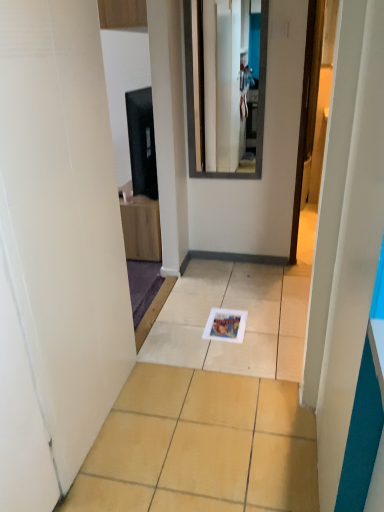
Question: From the image's perspective, is white glossy tile at center above or below smooth glass mirror at upper center?

Choices:
 (A) above
 (B) below

Answer: (B)

Question: Is white glossy tile at center wider or thinner than smooth glass mirror at upper center?

Choices:
 (A) wide
 (B) thin

Answer: (A)

Question: Which object is positioned farthest from the matte black tv at upper left?

Choices:
 (A) white glossy tile at center
 (B) smooth glass mirror at upper center

Answer: (A)

Question: Based on their relative distances, which object is farther from the matte black tv at upper left?

Choices:
 (A) white glossy tile at center
 (B) smooth glass mirror at upper center

Answer: (A)